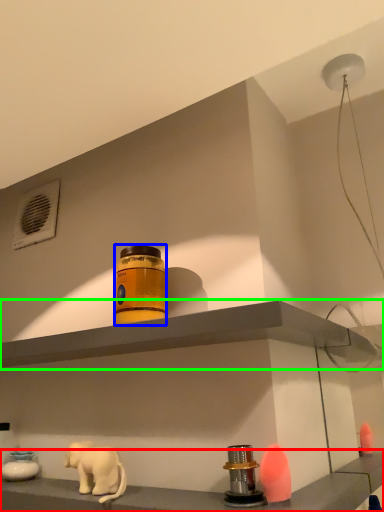
Question: Considering the real-world distances, which object is farthest from shelf (highlighted by a red box)? bottle (highlighted by a blue box) or shelf (highlighted by a green box)?

Choices:
 (A) bottle
 (B) shelf

Answer: (A)